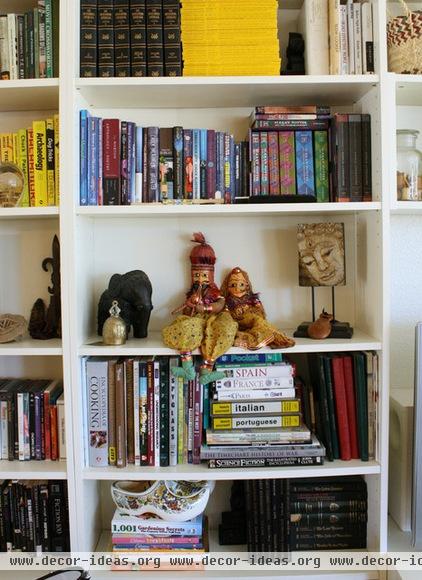
The image size is (422, 580). Identify the location of books on shelf below the top shelf of bookcase on the left. (5, 151), (13, 151), (21, 153), (29, 148), (38, 137), (48, 135), (54, 132).